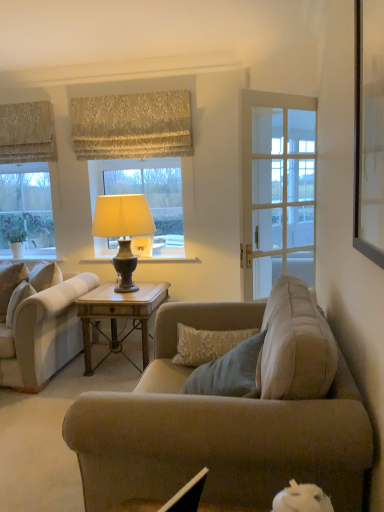
Question: Is white glass window at center, placed as the first window when sorted from right to left, beside wooden table at center?

Choices:
 (A) yes
 (B) no

Answer: (B)

Question: From the image's perspective, is white glass window at center, which appears as the second window when viewed from the left, on wooden table at center?

Choices:
 (A) no
 (B) yes

Answer: (B)

Question: Could you tell me if white glass window at center, which appears as the second window when viewed from the left, is turned towards wooden table at center?

Choices:
 (A) no
 (B) yes

Answer: (A)

Question: Does white glass window at center, which appears as the second window when viewed from the left, have a greater height compared to wooden table at center?

Choices:
 (A) yes
 (B) no

Answer: (A)

Question: Does white glass window at center, placed as the first window when sorted from right to left, have a greater width compared to wooden table at center?

Choices:
 (A) no
 (B) yes

Answer: (A)

Question: From a real-world perspective, is clear glass window at left, arranged as the 2th window when viewed from the right, above or below light beige fabric couch at left?

Choices:
 (A) above
 (B) below

Answer: (A)

Question: Which is correct: clear glass window at left, arranged as the 2th window when viewed from the right, is inside light beige fabric couch at left, or outside of it?

Choices:
 (A) inside
 (B) outside

Answer: (B)

Question: Is point (54, 154) positioned closer to the camera than point (49, 317)?

Choices:
 (A) closer
 (B) farther

Answer: (B)

Question: Is clear glass window at left, which ranks as the 1th window in left-to-right order, taller or shorter than light beige fabric couch at left?

Choices:
 (A) tall
 (B) short

Answer: (B)

Question: In terms of width, does gold textured fabric at upper center, arranged as the second curtain when viewed from the left, look wider or thinner when compared to wooden picture frame at upper right?

Choices:
 (A) thin
 (B) wide

Answer: (B)

Question: Would you say gold textured fabric at upper center, arranged as the second curtain when viewed from the left, is inside or outside wooden picture frame at upper right?

Choices:
 (A) outside
 (B) inside

Answer: (A)

Question: From a real-world perspective, is gold textured fabric at upper center, arranged as the second curtain when viewed from the left, positioned above or below wooden picture frame at upper right?

Choices:
 (A) above
 (B) below

Answer: (A)

Question: From the image's perspective, is gold textured fabric at upper center, the 1th curtain viewed from the right, located above or below wooden picture frame at upper right?

Choices:
 (A) below
 (B) above

Answer: (B)

Question: Is wooden table at center in front of or behind clear glass window at left, arranged as the 2th window when viewed from the right, in the image?

Choices:
 (A) front
 (B) behind

Answer: (A)

Question: Does point (144, 353) appear closer or farther from the camera than point (46, 179)?

Choices:
 (A) closer
 (B) farther

Answer: (A)